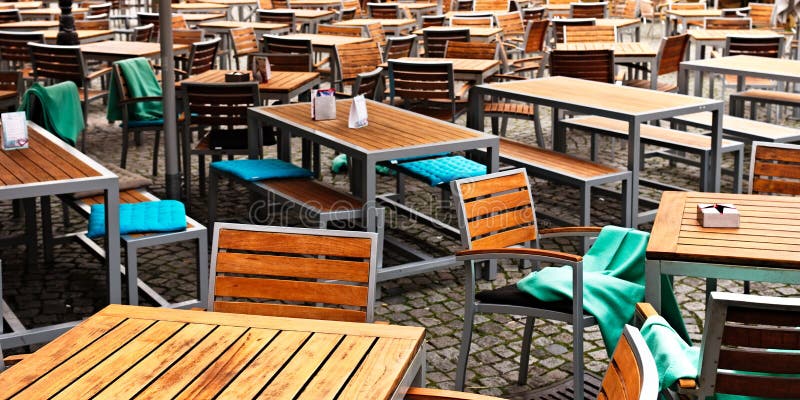
Identify the location of items on tables. This screenshot has height=400, width=800. (18, 129), (725, 219), (318, 98), (369, 115), (264, 71), (234, 72).